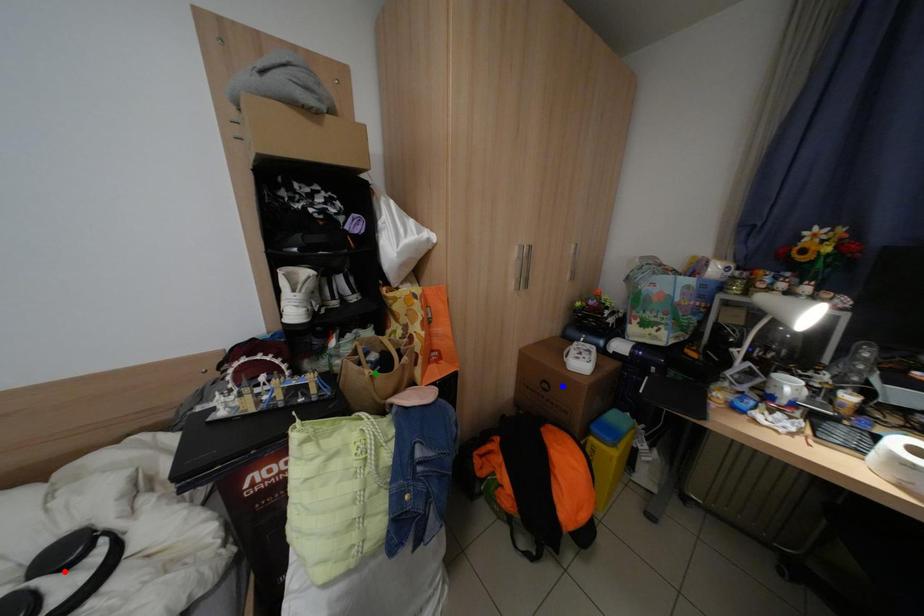
Order these from nearest to farthest:
A) red point
B) green point
C) blue point

red point, green point, blue point